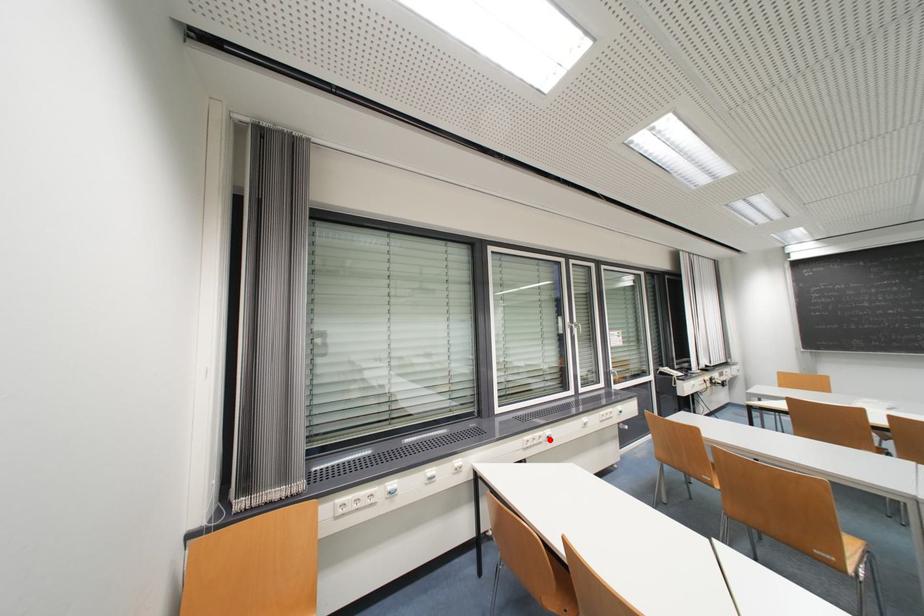
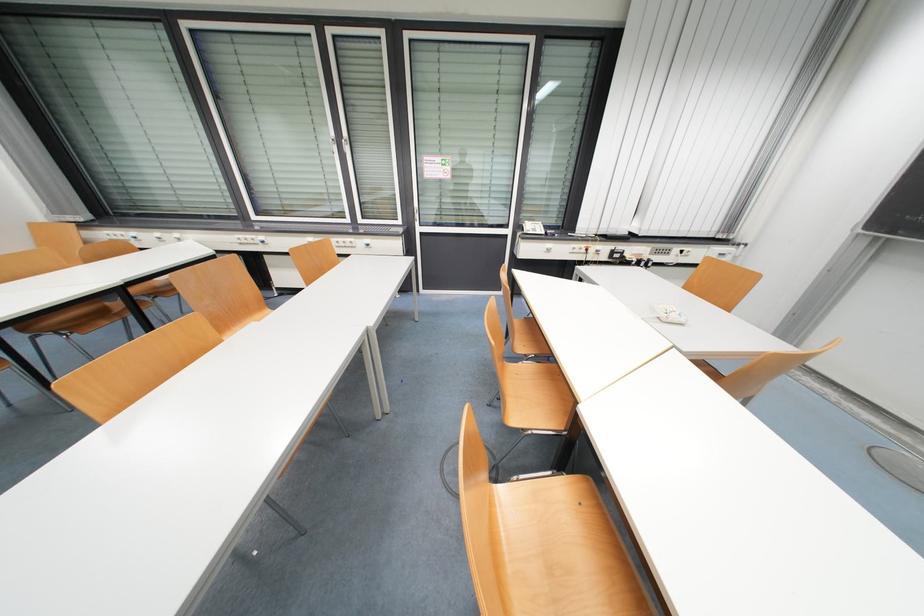
Question: I am providing you with two images of the same scene from different viewpoints. Given a red point in image1, look at the same physical point in image2. Is it:

Choices:
 (A) Closer to the viewpoint
 (B) Farther from the viewpoint

Answer: (B)